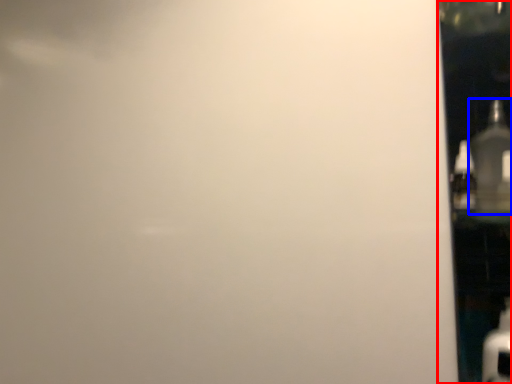
Question: Which of the following is the closest to the observer, glass door (highlighted by a red box) or bottle (highlighted by a blue box)?

Choices:
 (A) glass door
 (B) bottle

Answer: (A)